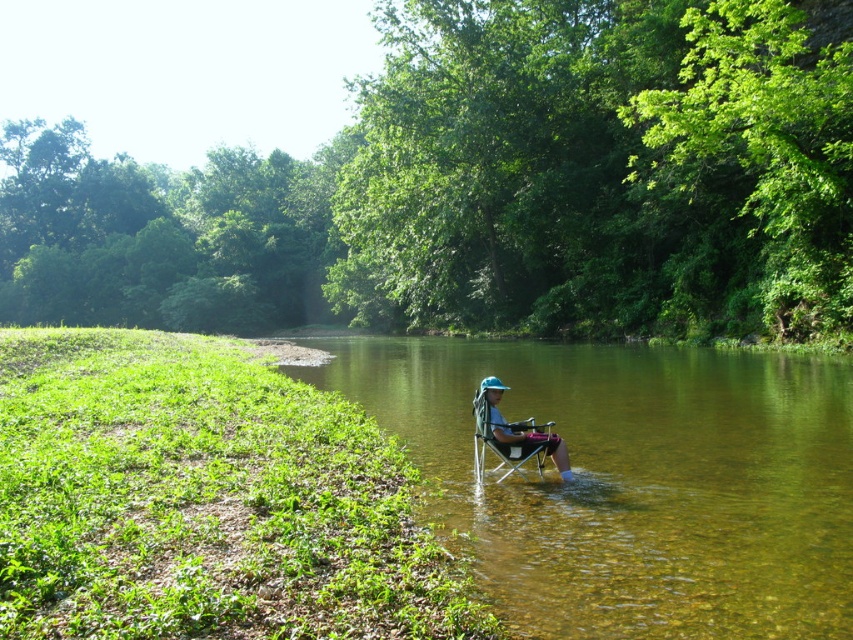
Question: Does clear water at chair right come in front of matte blue chair at center?

Choices:
 (A) no
 (B) yes

Answer: (B)

Question: Among these points, which one is farthest from the camera?

Choices:
 (A) (494, 396)
 (B) (770, 525)

Answer: (A)

Question: Which object is farther from the camera taking this photo?

Choices:
 (A) matte blue chair at center
 (B) clear water at chair right

Answer: (A)

Question: Which of the following is the farthest from the observer?

Choices:
 (A) (804, 509)
 (B) (494, 404)

Answer: (B)

Question: Is clear water at chair right positioned at the back of matte blue chair at center?

Choices:
 (A) yes
 (B) no

Answer: (B)

Question: Is clear water at chair right further to camera compared to matte blue chair at center?

Choices:
 (A) yes
 (B) no

Answer: (B)